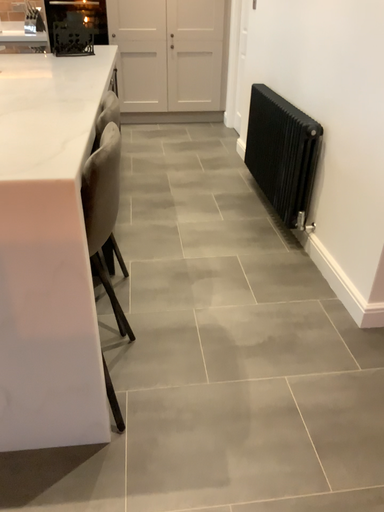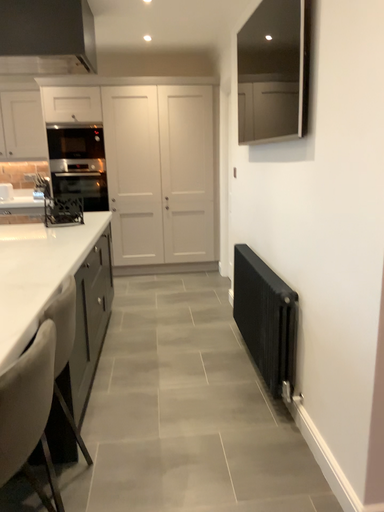
Question: Which way did the camera rotate in the video?

Choices:
 (A) rotated upward
 (B) rotated downward

Answer: (A)